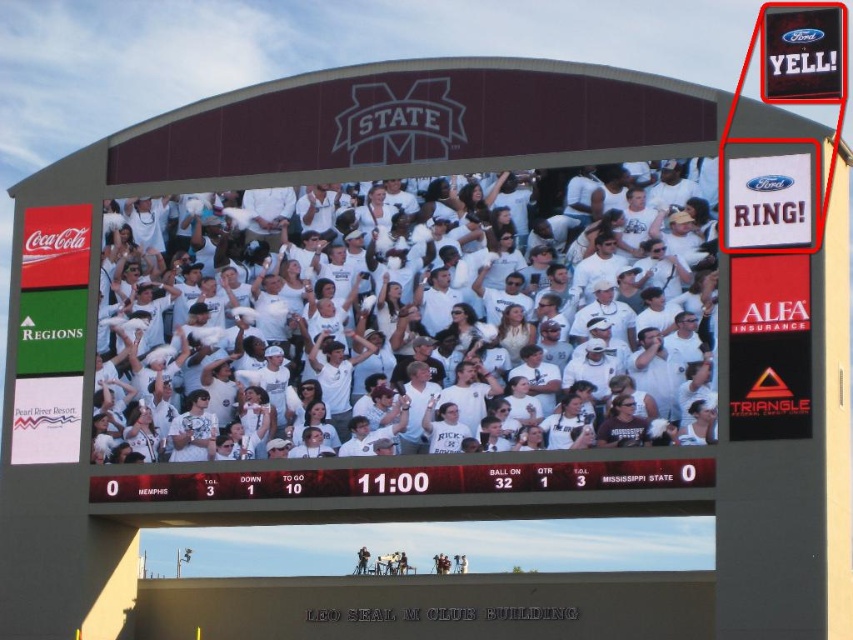
Between white plastic scoreboard at center and white paper coca-cola sign at left, which one is positioned higher?

white paper coca-cola sign at left is higher up.

Does white plastic scoreboard at center have a greater height compared to white paper coca-cola sign at left?

No.

Who is more forward, (445, 468) or (38, 298)?

Positioned in front is point (445, 468).

I want to click on white plastic scoreboard at center, so click(404, 481).

Is white paper coca-cola sign at left shorter than red plastic sign at upper right?

Correct, white paper coca-cola sign at left is not as tall as red plastic sign at upper right.

Identify the location of white paper coca-cola sign at left. The image size is (853, 640). (50, 333).

Where is `white paper coca-cola sign at left`? This screenshot has height=640, width=853. white paper coca-cola sign at left is located at coordinates (50, 333).

Is point (341, 468) farther from camera compared to point (807, 35)?

No, it is in front of (807, 35).

Is point (549, 468) closer to camera compared to point (804, 56)?

Yes, it is.

At what (x,y) coordinates should I click in order to perform the action: click on white plastic scoreboard at center. Please return your answer as a coordinate pair (x, y). The image size is (853, 640). Looking at the image, I should click on (404, 481).